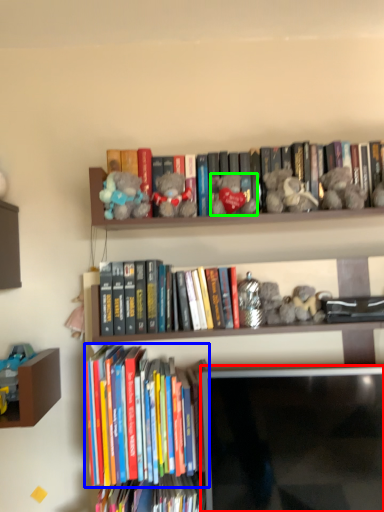
Question: Which object is the farthest from computer monitor (highlighted by a red box)? Choose among these: book (highlighted by a blue box) or toy (highlighted by a green box).

Choices:
 (A) book
 (B) toy

Answer: (B)